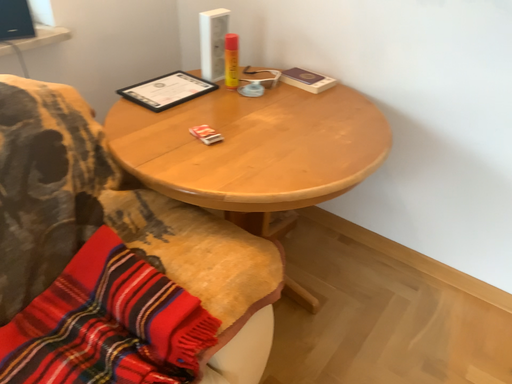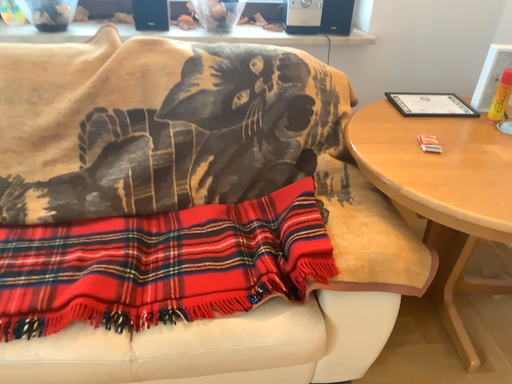
Question: Which way did the camera rotate in the video?

Choices:
 (A) rotated right
 (B) rotated left

Answer: (B)